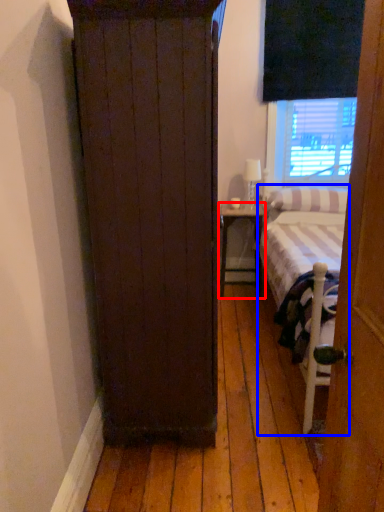
Question: Which point is further to the camera, nightstand (highlighted by a red box) or bed (highlighted by a blue box)?

Choices:
 (A) nightstand
 (B) bed

Answer: (A)